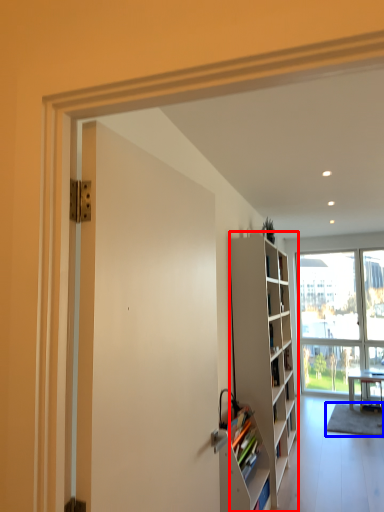
Question: Among these objects, which one is nearest to the camera, cabinetry (highlighted by a red box) or carpets (highlighted by a blue box)?

Choices:
 (A) cabinetry
 (B) carpets

Answer: (A)